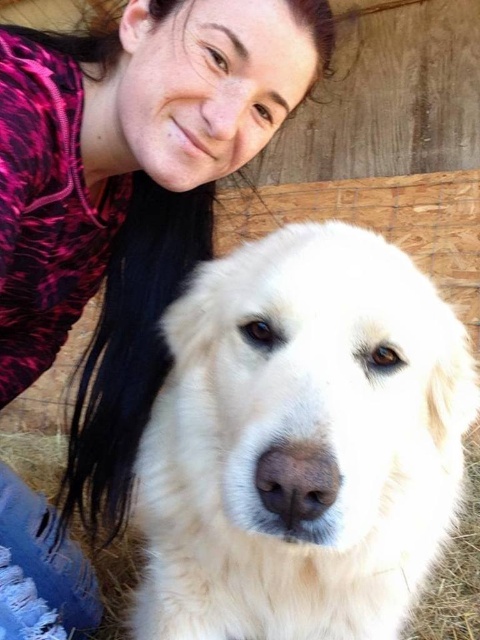
Question: Is white fluffy dog at center closer to the viewer compared to pink printed hoodie at upper left?

Choices:
 (A) no
 (B) yes

Answer: (B)

Question: Which object appears farthest from the camera in this image?

Choices:
 (A) pink printed hoodie at upper left
 (B) white fluffy dog at center

Answer: (A)

Question: Which object appears closest to the camera in this image?

Choices:
 (A) pink printed hoodie at upper left
 (B) white fluffy dog at center

Answer: (B)

Question: Is white fluffy dog at center positioned behind pink printed hoodie at upper left?

Choices:
 (A) yes
 (B) no

Answer: (B)

Question: Is the position of white fluffy dog at center less distant than that of pink printed hoodie at upper left?

Choices:
 (A) no
 (B) yes

Answer: (B)

Question: Which point is farther from the camera taking this photo?

Choices:
 (A) (264, 432)
 (B) (272, 20)

Answer: (B)